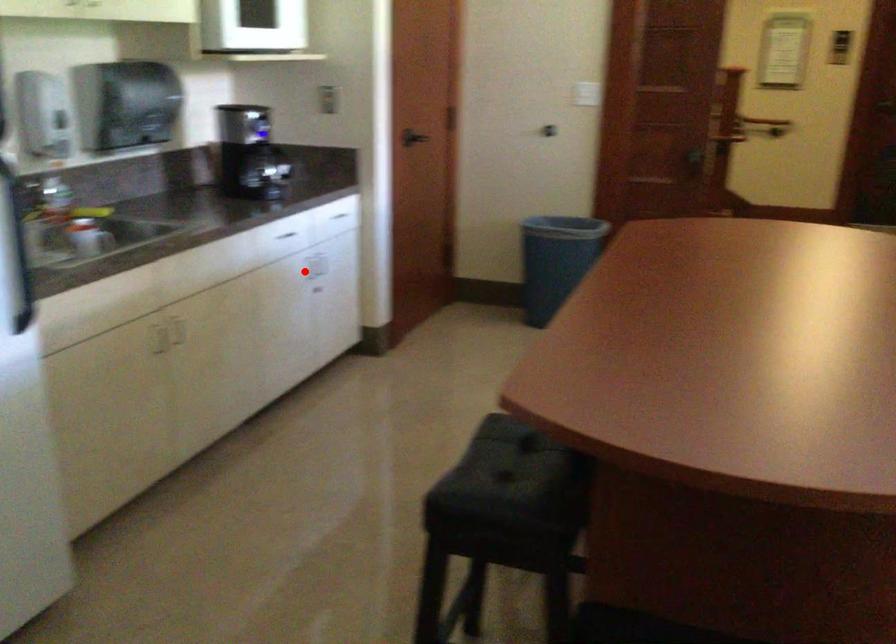
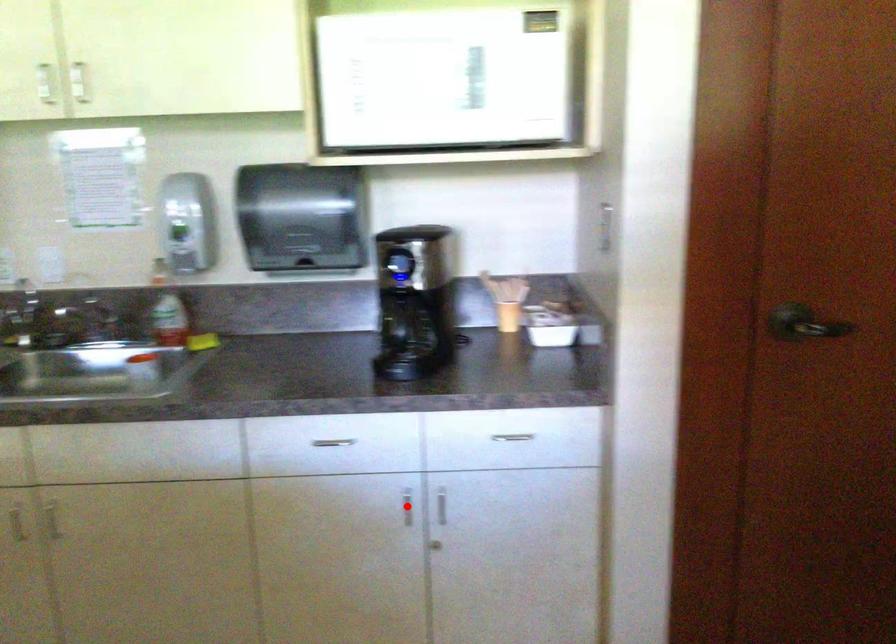
I am providing you with two images of the same scene from different viewpoints. A red point is marked on the first image and another point is marked on the second image. Do the highlighted points in image1 and image2 indicate the same real-world spot?

Yes